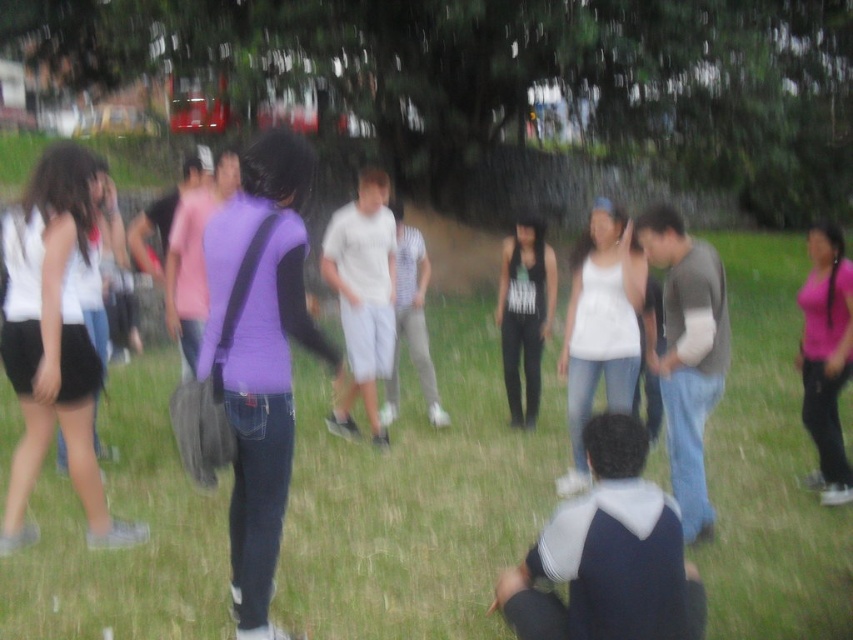
Who is more distant from viewer, (294,609) or (80,424)?

The point (80,424) is more distant.

Identify the location of green grass at center. (416, 500).

Find the location of a particular element. green grass at center is located at coordinates (416, 500).

In the scene shown: Can you confirm if pink matte tank top at right is smaller than black matte tank top at center?

No, pink matte tank top at right is not smaller than black matte tank top at center.

Consider the image. Is pink matte tank top at right thinner than black matte tank top at center?

Incorrect, pink matte tank top at right's width is not less than black matte tank top at center's.

Who is more forward, (824, 227) or (503, 353)?

Point (824, 227)

The width and height of the screenshot is (853, 640). Identify the location of pink matte tank top at right. (827, 356).

Based on the photo, is white matte tank top at center shorter than pink matte tank top at right?

No, white matte tank top at center is not shorter than pink matte tank top at right.

Which is in front, point (621, 358) or point (804, 400)?

Positioned in front is point (621, 358).

What are the coordinates of `white matte tank top at center` in the screenshot? It's located at (601, 326).